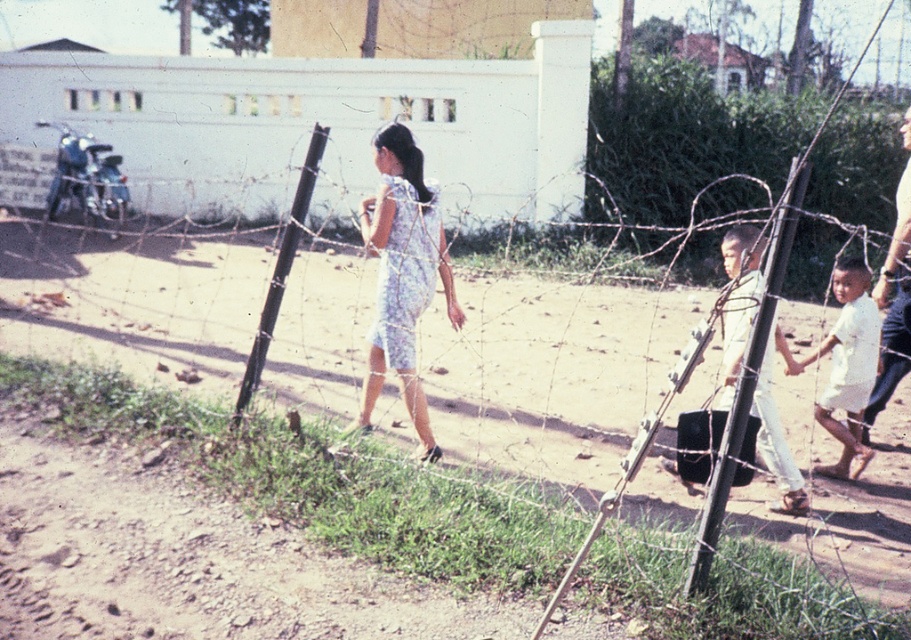
Question: Which point is closer to the camera?

Choices:
 (A) light beige pants at center
 (B) light blue dress at right

Answer: (A)

Question: Does light beige pants at center have a smaller size compared to white cotton shirt at center-right?

Choices:
 (A) no
 (B) yes

Answer: (A)

Question: Based on their relative distances, which object is farther from the white cotton shirt at center-right?

Choices:
 (A) light blue dress at right
 (B) light beige pants at center

Answer: (B)

Question: Does white floral dress at center appear on the left side of light beige pants at center?

Choices:
 (A) yes
 (B) no

Answer: (A)

Question: Which of these objects is positioned farthest from the white cotton shirt at center-right?

Choices:
 (A) white floral dress at center
 (B) light blue dress at right

Answer: (A)

Question: Does white floral dress at center appear over white cotton shirt at center-right?

Choices:
 (A) no
 (B) yes

Answer: (B)